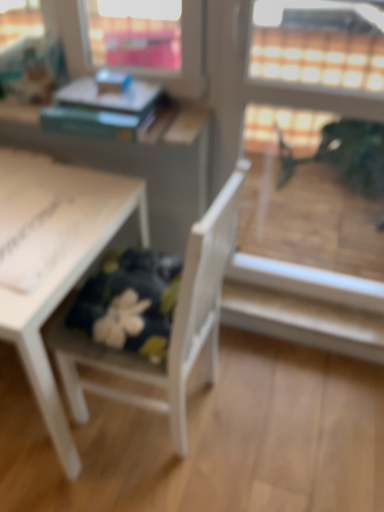
Image resolution: width=384 pixels, height=512 pixels. I want to click on vacant area that is in front of white wood chair at lower left, so click(x=150, y=482).